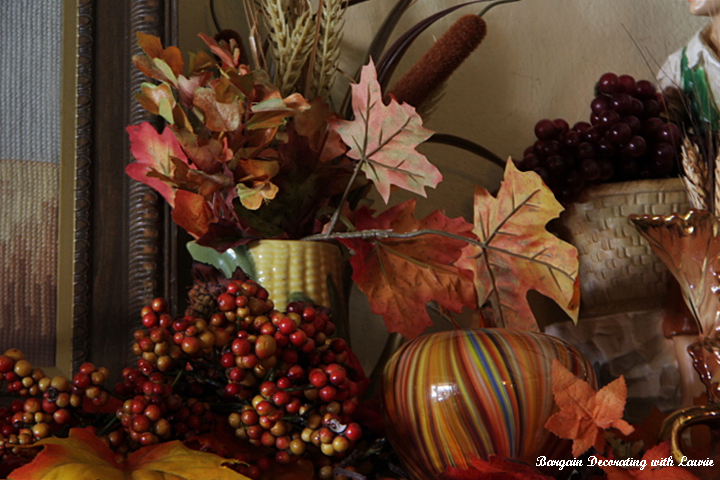
Identify the location of swirled vase. (446, 374).